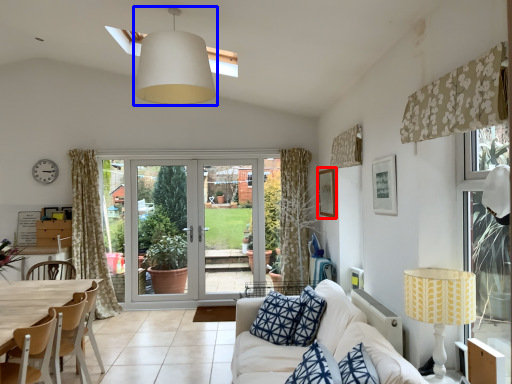
Question: Which object appears farthest to the camera in this image, picture frame (highlighted by a red box) or lamp (highlighted by a blue box)?

Choices:
 (A) picture frame
 (B) lamp

Answer: (A)